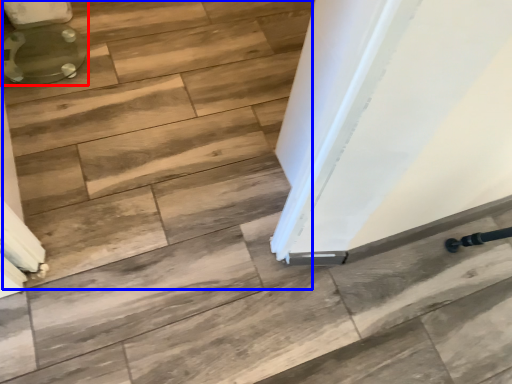
Question: Which of the following is the farthest to the observer, toilet (highlighted by a red box) or stair (highlighted by a blue box)?

Choices:
 (A) toilet
 (B) stair

Answer: (A)